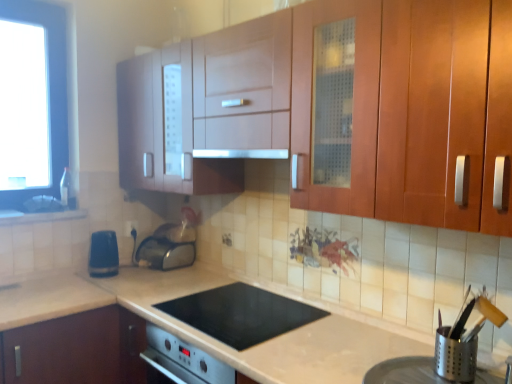
At what (x,y) coordinates should I click in order to perform the action: click on free point to the right of blue plastic kettle at lower left, the first appliance from the left. Please return your answer as a coordinate pair (x, y). The height and width of the screenshot is (384, 512). Looking at the image, I should click on (139, 276).